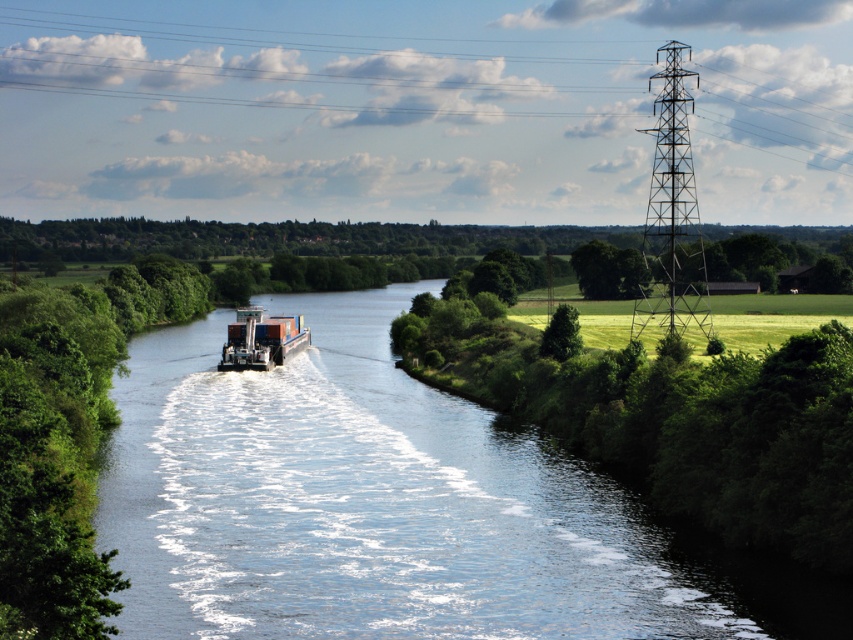
Is clear blue water at center above metallic tower at upper center?

No, clear blue water at center is not above metallic tower at upper center.

From the picture: Who is more distant from viewer, (421, 564) or (674, 26)?

The point (674, 26) is more distant.

In order to click on clear blue water at center in this screenshot , I will do `click(364, 500)`.

Is metallic tower at upper center further to the viewer compared to metallic container ship at center?

Yes, metallic tower at upper center is behind metallic container ship at center.

Which is behind, point (717, 83) or point (263, 344)?

Positioned behind is point (717, 83).

Is point (462, 60) less distant than point (270, 349)?

No, it is behind (270, 349).

This screenshot has height=640, width=853. What are the coordinates of `metallic tower at upper center` in the screenshot? It's located at (419, 77).

Between clear blue water at center and metallic container ship at center, which one has more height?

clear blue water at center

Is clear blue water at center positioned in front of metallic container ship at center?

Yes.

You are a GUI agent. You are given a task and a screenshot of the screen. Output one action in this format:
    pyautogui.click(x=<x>, y=<y>)
    Task: Click on the clear blue water at center
    
    Given the screenshot: What is the action you would take?
    pyautogui.click(x=364, y=500)